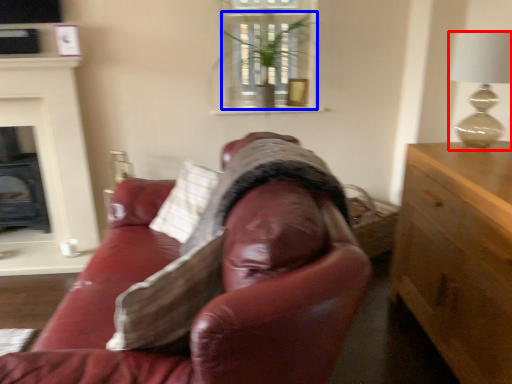
Question: Which of the following is the closest to the observer, lamp (highlighted by a red box) or houseplant (highlighted by a blue box)?

Choices:
 (A) lamp
 (B) houseplant

Answer: (A)